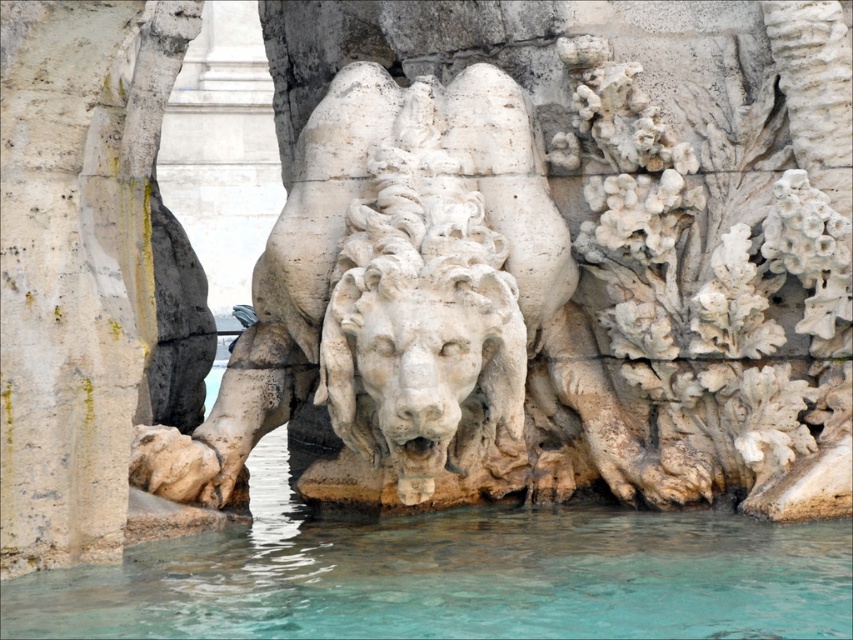
Question: Is clear water at lower center to the right of white stone pillar at left from the viewer's perspective?

Choices:
 (A) yes
 (B) no

Answer: (A)

Question: Does clear water at lower center lie in front of white stone pillar at left?

Choices:
 (A) no
 (B) yes

Answer: (B)

Question: Where is clear water at lower center located in relation to white stone pillar at left in the image?

Choices:
 (A) left
 (B) right

Answer: (B)

Question: Which object appears closest to the camera in this image?

Choices:
 (A) white stone pillar at left
 (B) clear water at lower center

Answer: (B)

Question: Which point appears closest to the camera in this image?

Choices:
 (A) (15, 589)
 (B) (144, 420)

Answer: (A)